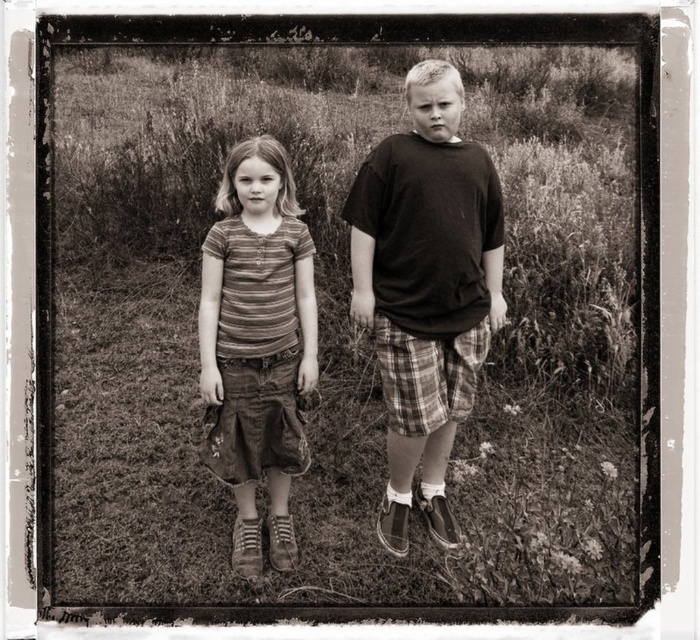
Based on the scene description, where is the point located at coordinates [349,321]?

The point at coordinates [349,321] marks the grassy field at center.

You are a photographer trying to capture a clear shot of the dark brown cotton shirt at center in the image. Considering the grassy field at center is also present, will the shirt be easily visible against the background?

The grassy field at center has a larger size compared to dark brown cotton shirt at center, so the shirt may be less visible as it is smaller in size relative to the grassy field.

You are a photographer adjusting your camera to focus on the dark brown cotton shirt at center and the striped cotton shirt at center. Which shirt should you focus on first to ensure it appears sharp in the photo?

The dark brown cotton shirt at center is closer to the viewer than the striped cotton shirt at center, so you should focus on the dark brown cotton shirt at center first to ensure it appears sharp.